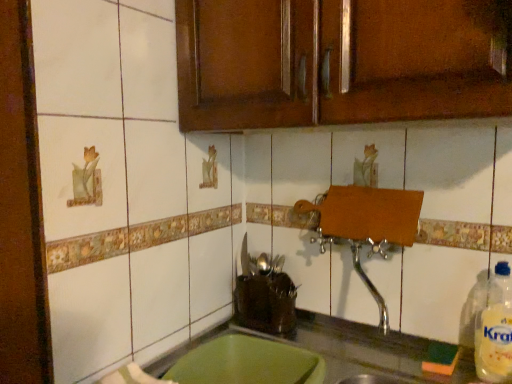
Question: In the image, is brown wood cabinet at upper center positioned in front of or behind clear plastic bottle at right?

Choices:
 (A) behind
 (B) front

Answer: (B)

Question: Is brown wood cabinet at upper center to the left or to the right of clear plastic bottle at right in the image?

Choices:
 (A) right
 (B) left

Answer: (B)

Question: Which object is positioned closest to the clear plastic bottle at right?

Choices:
 (A) green plastic tray at lower center
 (B) brown wood cabinet at upper center

Answer: (A)

Question: Which of these objects is positioned closest to the clear plastic bottle at right?

Choices:
 (A) brown wood cabinet at upper center
 (B) green plastic tray at lower center

Answer: (B)